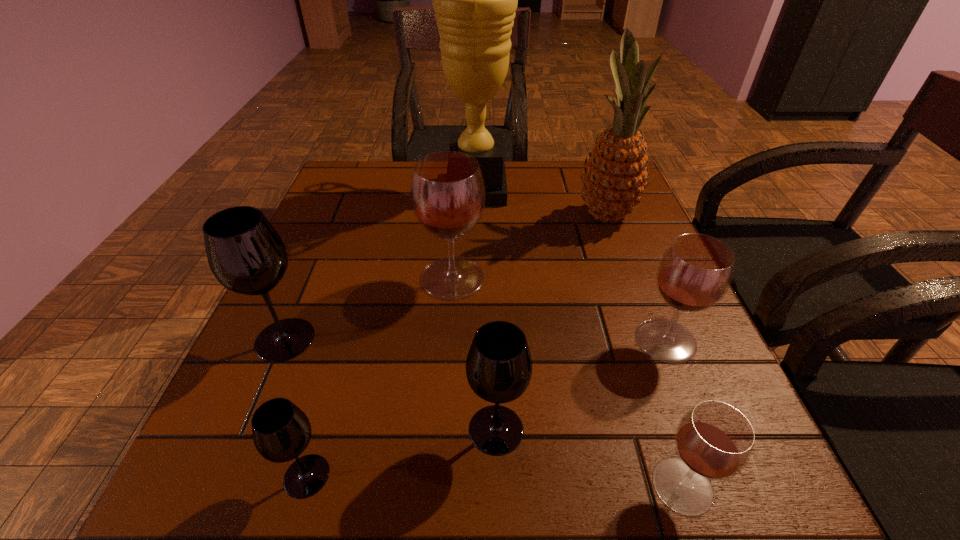
I want to click on trophy cup located in the far edge section of the desktop, so click(474, 0).

Where is `pineapple that is at the far edge`? This screenshot has width=960, height=540. pineapple that is at the far edge is located at coordinates (615, 175).

This screenshot has width=960, height=540. Find the location of `pineapple that is at the right edge`. pineapple that is at the right edge is located at coordinates (615, 175).

Locate an element on the screen. object situated at the near left corner is located at coordinates (281, 431).

Where is `object at the far right corner`? object at the far right corner is located at coordinates (615, 175).

At what (x,y) coordinates should I click in order to perform the action: click on object that is at the near right corner. Please return your answer as a coordinate pair (x, y). The height and width of the screenshot is (540, 960). Looking at the image, I should click on (714, 441).

Image resolution: width=960 pixels, height=540 pixels. In order to click on free space at the far edge of the desktop in this screenshot , I will do click(x=514, y=172).

The width and height of the screenshot is (960, 540). In the image, there is a desktop. Identify the location of vacant region at the left edge. (218, 418).

You are a GUI agent. You are given a task and a screenshot of the screen. Output one action in this format:
    pyautogui.click(x=<x>, y=<y>)
    Task: Click on the free space at the right edge of the desktop
    The image size is (960, 540).
    Given the screenshot: What is the action you would take?
    pyautogui.click(x=618, y=322)

In the image, there is a desktop. Find the location of `vacant space at the far left corner`. vacant space at the far left corner is located at coordinates (352, 185).